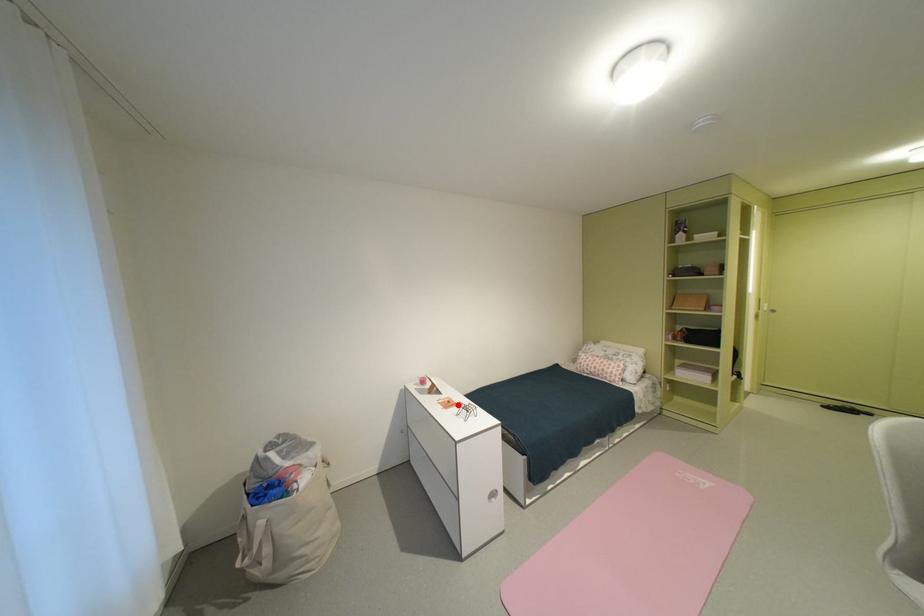
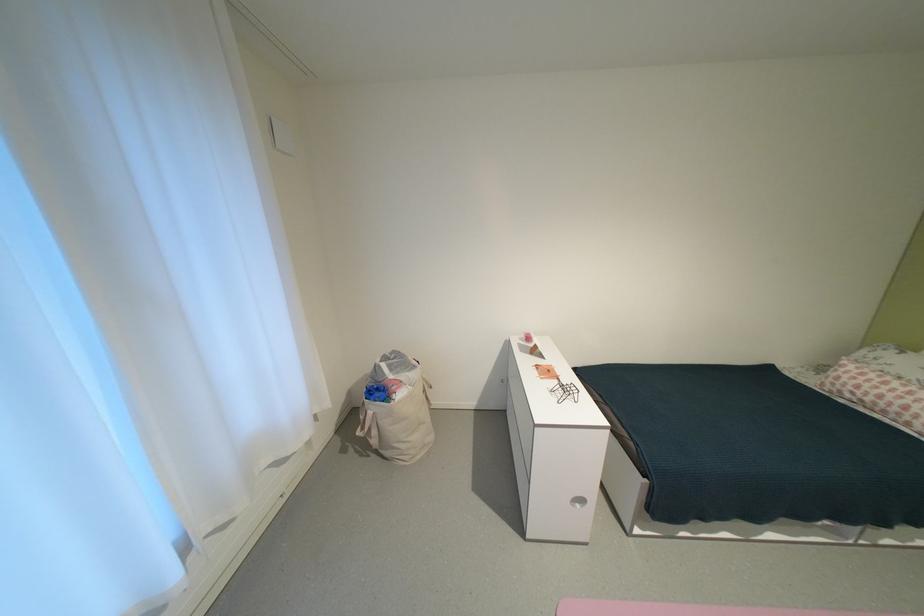
Question: I am providing you with two images of the same scene from different viewpoints. Image1 has a red point marked. In image2, the corresponding 3D location appears at what relative position? Reply with the corresponding letter.

Choices:
 (A) Closer
 (B) Farther

Answer: (B)